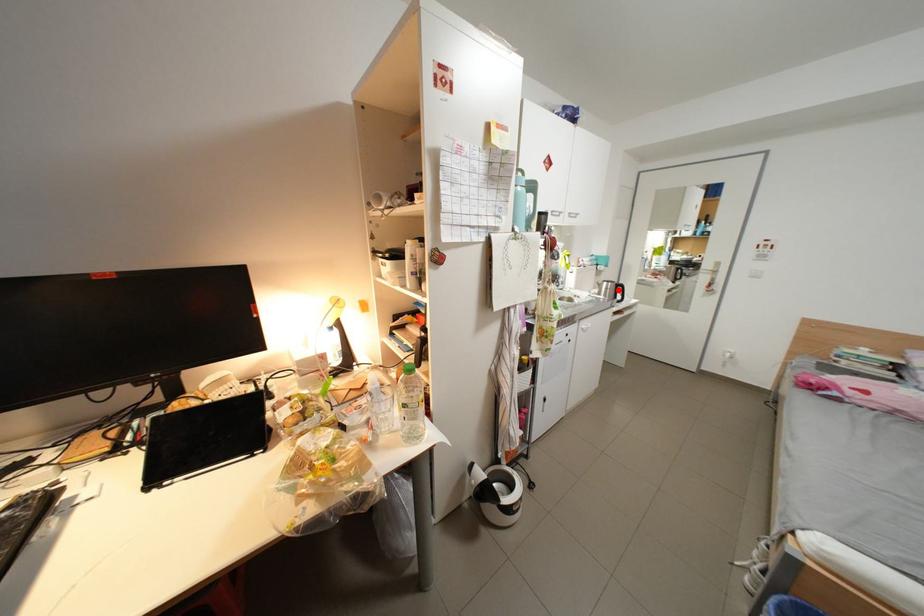
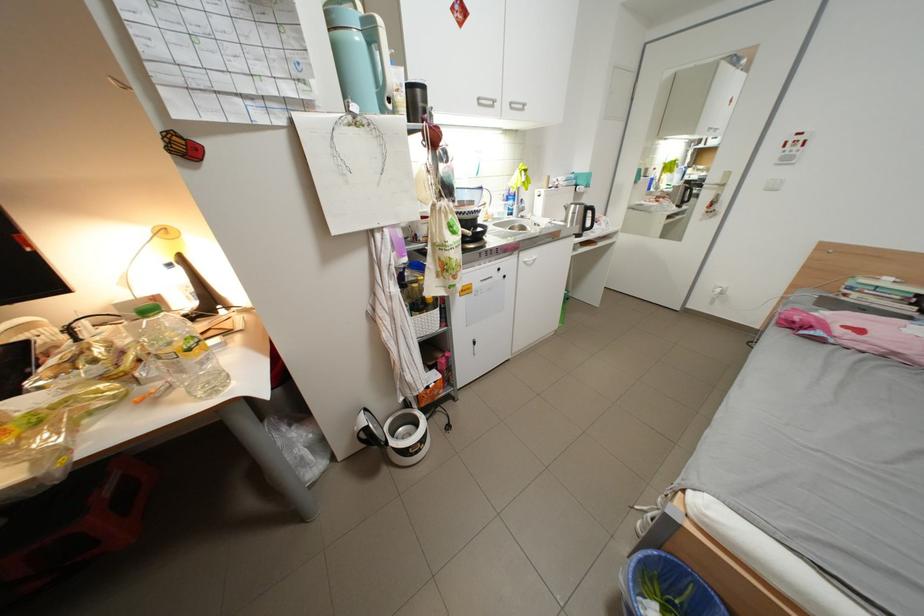
The point at the highlighted location is marked in the first image. Where is the corresponding point in the second image?

(585, 215)